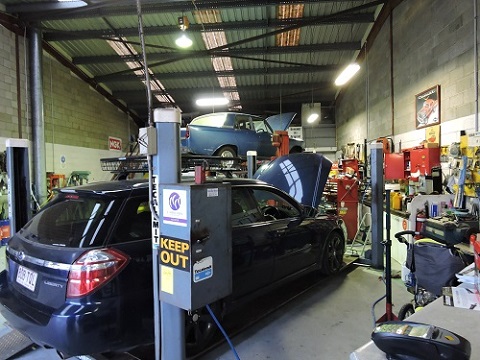
This screenshot has height=360, width=480. In order to click on concrete floor in this screenshot , I will do `click(2, 324)`, `click(45, 353)`, `click(264, 352)`, `click(382, 273)`, `click(344, 298)`, `click(329, 317)`.